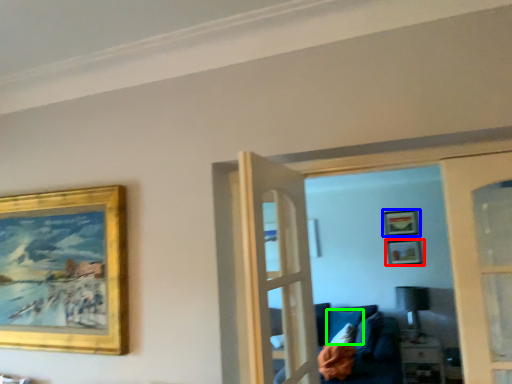
Question: Which is farther away from picture frame (highlighted by a red box)? picture frame (highlighted by a blue box) or pillow (highlighted by a green box)?

Choices:
 (A) picture frame
 (B) pillow

Answer: (B)